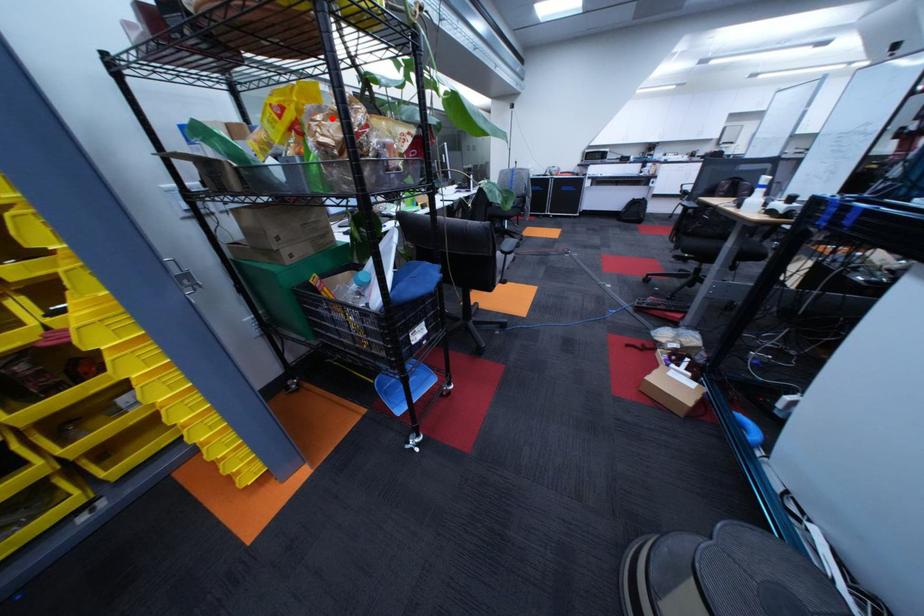
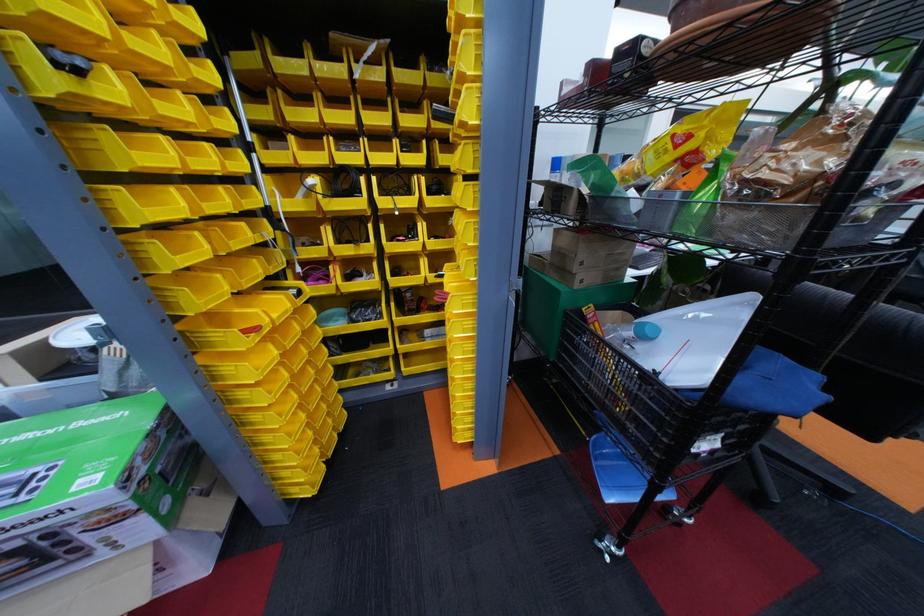
Where in the second image is the point corresponding to the highlighted location from the first image?

(801, 148)